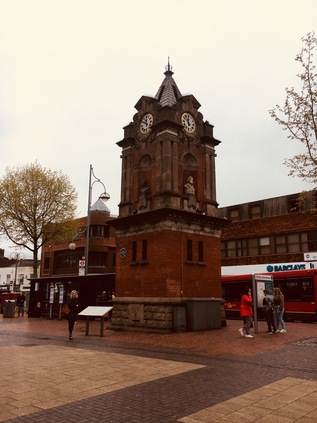
In order to click on clock in this screenshot , I will do `click(145, 119)`, `click(188, 120)`.